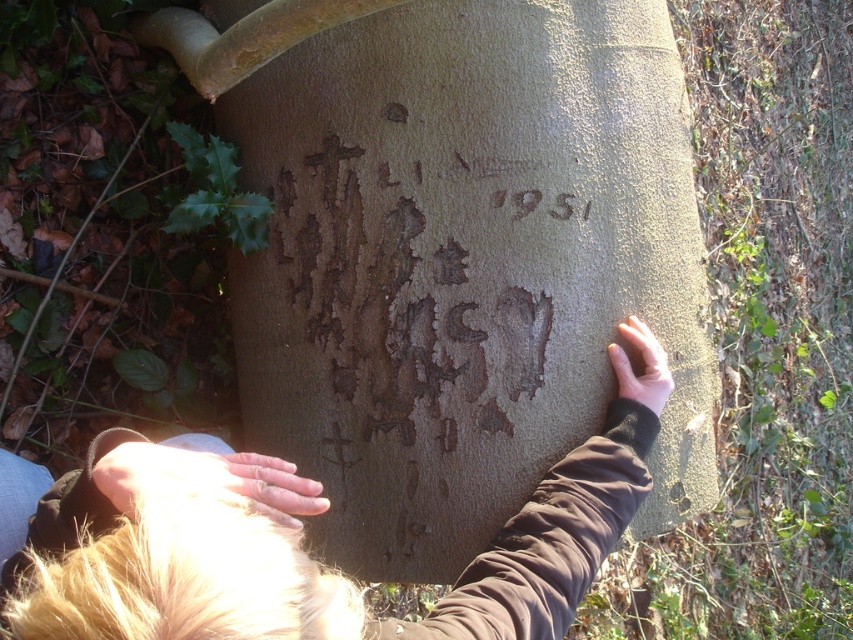
Question: Which of the following is the farthest from the observer?

Choices:
 (A) smooth skin hand at center
 (B) brown leather jacket at center
 (C) smooth skin hand at lower left

Answer: (A)

Question: Is smooth skin hand at lower left positioned in front of smooth skin hand at center?

Choices:
 (A) no
 (B) yes

Answer: (B)

Question: Based on their relative distances, which object is nearer to the smooth skin hand at center?

Choices:
 (A) smooth skin hand at lower left
 (B) brown leather jacket at center

Answer: (B)

Question: Which point is closer to the camera?

Choices:
 (A) (608, 349)
 (B) (514, 579)

Answer: (B)

Question: Is smooth skin hand at lower left below smooth skin hand at center?

Choices:
 (A) no
 (B) yes

Answer: (B)

Question: Considering the relative positions of brown leather jacket at center and smooth skin hand at lower left in the image provided, where is brown leather jacket at center located with respect to smooth skin hand at lower left?

Choices:
 (A) right
 (B) left

Answer: (A)